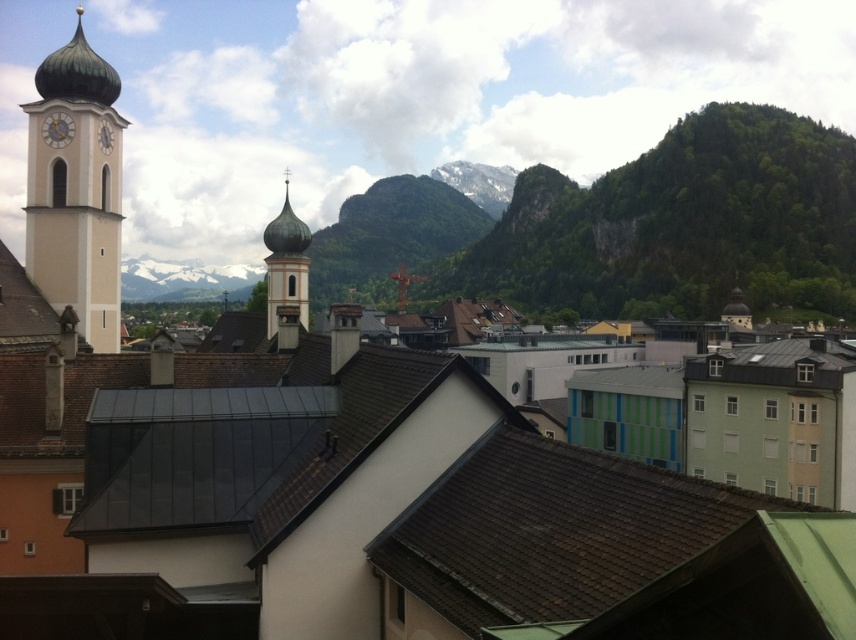
You are standing in the town square and want to take a photo of the two points mentioned. Which point, point (420, 608) or point (74, 275), will appear larger in your photo?

Point (420, 608) is closer to the camera than point (74, 275), so it will appear larger in the photo.

You are an architect planning to install a new antenna on the tallest structure in the town. Based on the image, which structure should you choose between the white stucco bell tower at left and the green copper dome at center?

The white stucco bell tower at left is taller than the green copper dome at center, so you should choose the white stucco bell tower at left to install the antenna.

You are an architect examining the town layout. You notice the brown shingles at center and the green copper dome at center. Which of these two features is located to the right of the other?

The brown shingles at center is positioned on the right side of green copper dome at center, so the brown shingles at center is to the right of the green copper dome at center.